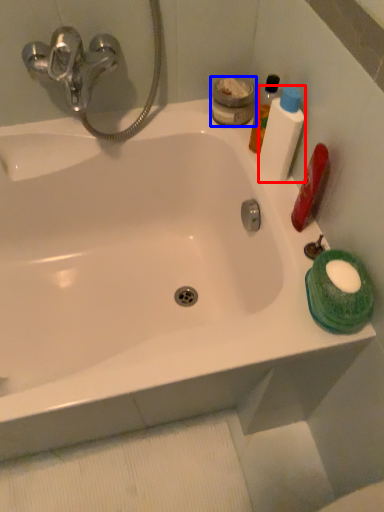
Question: Which point is closer to the camera, mouthwash (highlighted by a red box) or mouthwash (highlighted by a blue box)?

Choices:
 (A) mouthwash
 (B) mouthwash

Answer: (A)